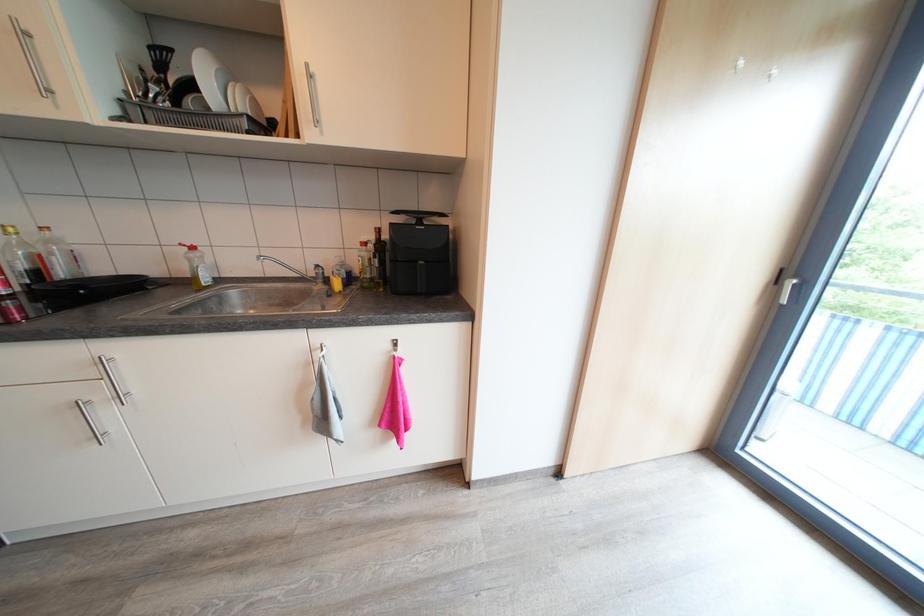
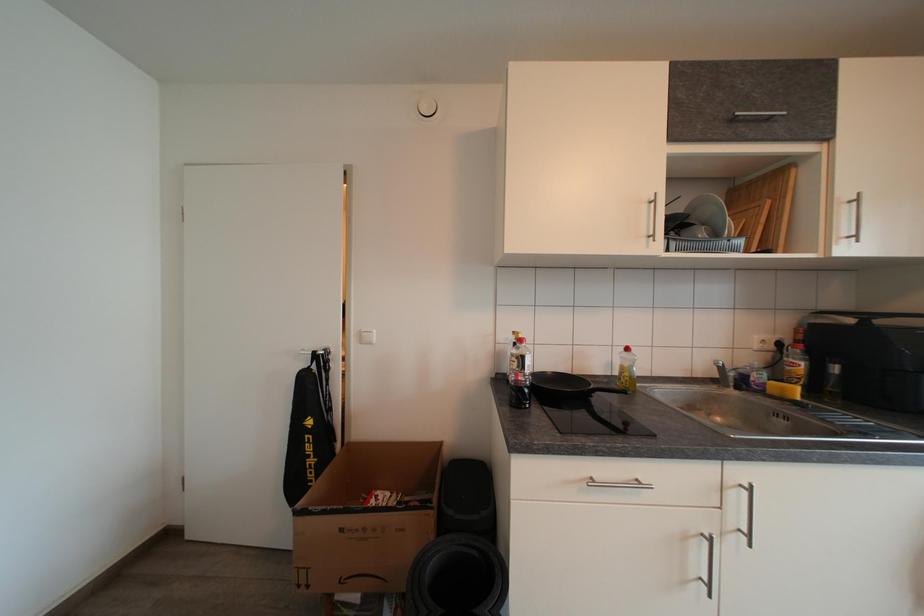
Question: Which direction would the cameraman need to move to produce the second image? Reply with the corresponding letter.

Choices:
 (A) Left
 (B) Right
 (C) Forward
 (D) Backward

Answer: (A)